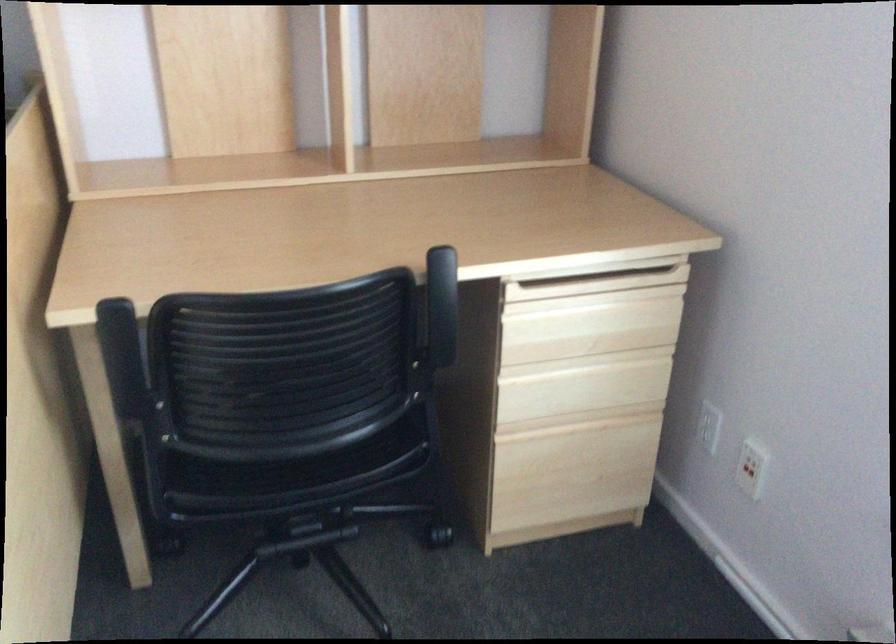
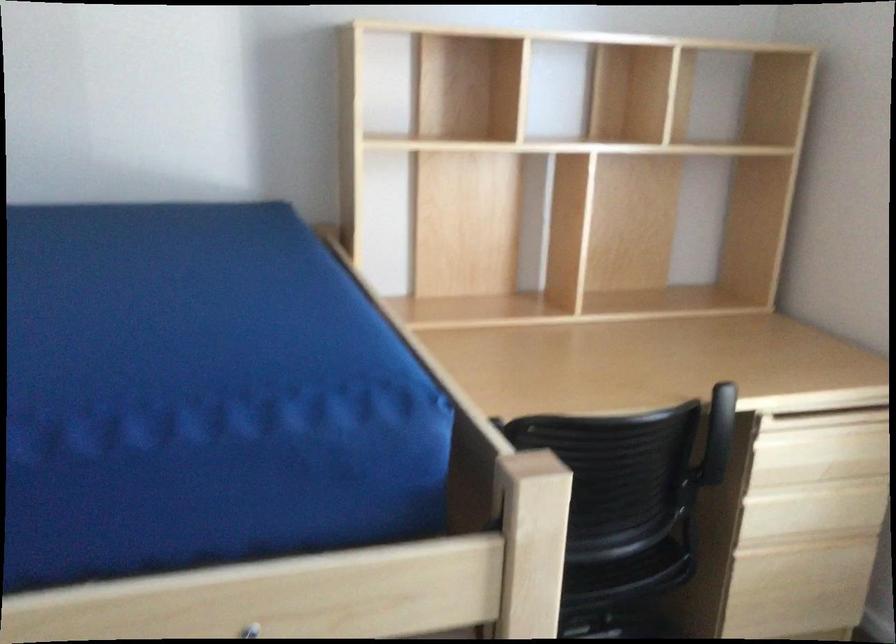
Question: I am providing you with two images of the same scene from different viewpoints. Please identify which objects are invisible in image2.

Choices:
 (A) black chair armrest
 (B) chair sitting surface
 (C) wooden drawer pull
 (D) red magazine

Answer: (A)